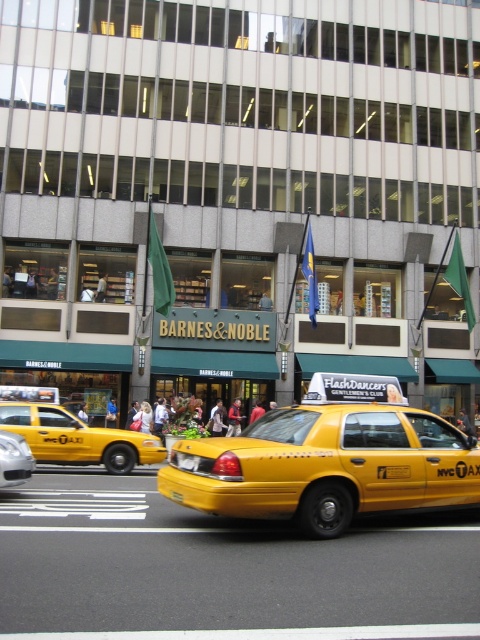
You are a pedestrian standing on the sidewalk in front of the Barnes and Noble. You want to cross the street to the park on the other side. Is the yellow matte taxi at center blocking your path to the silver metallic sedan at center?

The yellow matte taxi at center is positioned over silver metallic sedan at center, so the yellow matte taxi at center is blocking the path to the silver metallic sedan at center.

You are a pedestrian standing on the sidewalk in front of the Barnes and Noble bookstore. You see two taxis, the yellow matte taxi at center and the yellow rubber taxi cab at center. Which one is closer to you?

The yellow matte taxi at center is closer to you because it is in front of the yellow rubber taxi cab at center.